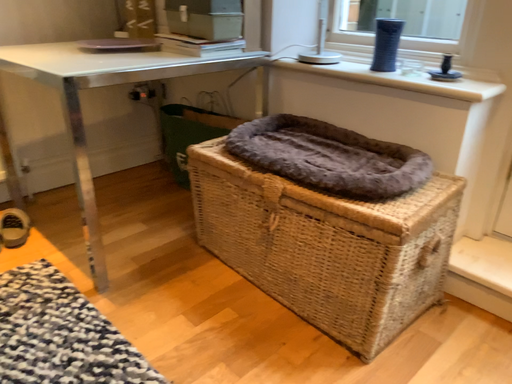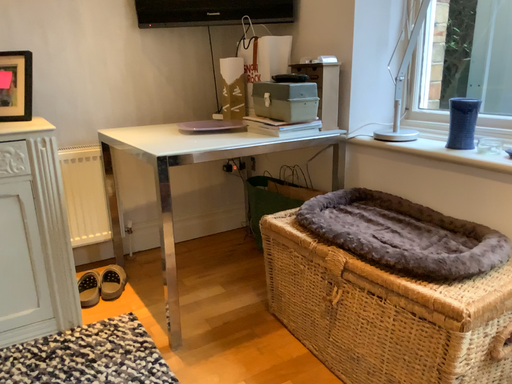
Question: How did the camera likely rotate when shooting the video?

Choices:
 (A) rotated left
 (B) rotated right

Answer: (A)